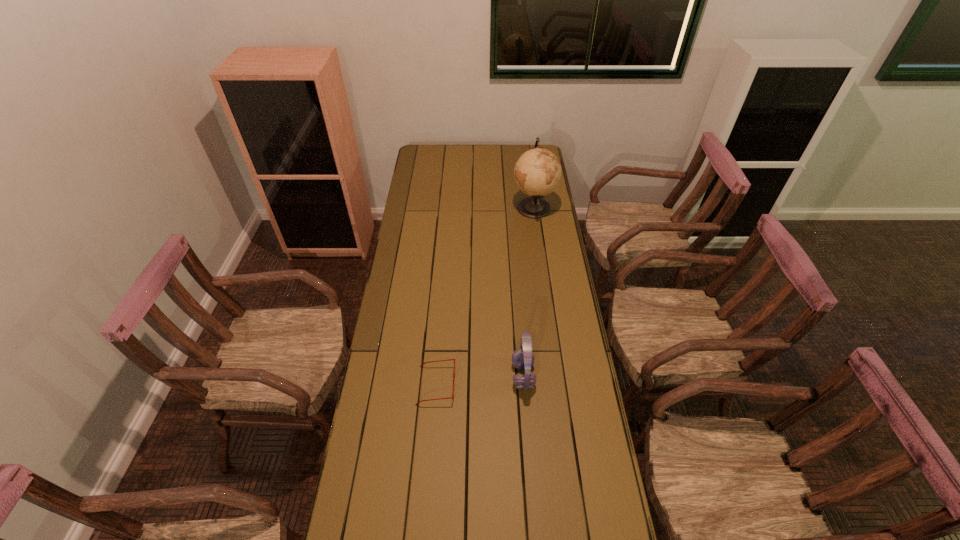
Image resolution: width=960 pixels, height=540 pixels. In order to click on globe in this screenshot , I will do `click(537, 172)`.

Identify the location of the tallest object. The image size is (960, 540). (537, 172).

You are a GUI agent. You are given a task and a screenshot of the screen. Output one action in this format:
    pyautogui.click(x=<x>, y=<y>)
    Task: Click on the second shortest object
    This screenshot has width=960, height=540.
    Given the screenshot: What is the action you would take?
    pyautogui.click(x=523, y=359)

Where is `spectacles`? The image size is (960, 540). spectacles is located at coordinates tap(448, 359).

At what (x,y) coordinates should I click in order to perform the action: click on the shortest object. Please return your answer as a coordinate pair (x, y). The image size is (960, 540). Looking at the image, I should click on (448, 359).

Where is `free space located 0.320m on the front-facing side of the globe`? free space located 0.320m on the front-facing side of the globe is located at coordinates (447, 208).

Identify the location of free space located 0.250m on the front-facing side of the globe. (462, 208).

Where is `vacant space located 0.100m on the front-facing side of the globe`? The height and width of the screenshot is (540, 960). vacant space located 0.100m on the front-facing side of the globe is located at coordinates (492, 208).

At what (x,y) coordinates should I click in order to perform the action: click on vacant space situated on the headband and ear cups of the headset. Please return your answer as a coordinate pair (x, y). The height and width of the screenshot is (540, 960). Looking at the image, I should click on pos(448,375).

At what (x,y) coordinates should I click in order to perform the action: click on vacant area situated 0.400m on the headband and ear cups of the headset. Please return your answer as a coordinate pair (x, y). This screenshot has height=540, width=960. Looking at the image, I should click on (397, 375).